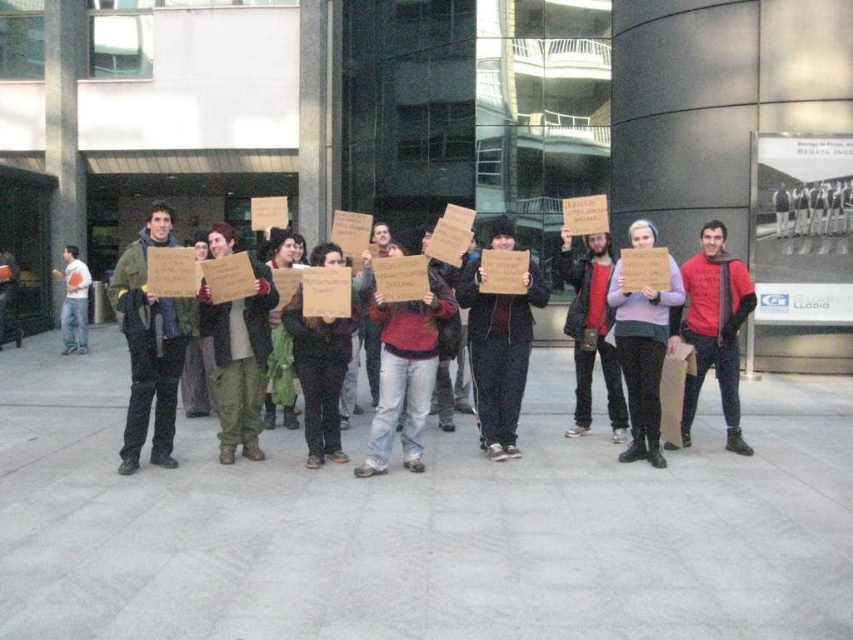
Describe the element at coordinates (498, 353) in the screenshot. I see `dark gray pants at center` at that location.

Locate an element on the screen. This screenshot has height=640, width=853. dark gray pants at center is located at coordinates (498, 353).

Can you confirm if matte cardboard sign at center is positioned to the left of matte red sweater at center?

Correct, you'll find matte cardboard sign at center to the left of matte red sweater at center.

Between point (172, 388) and point (399, 403), which one is positioned behind?

Point (172, 388)

Does point (268, 275) lie behind point (399, 422)?

No, (268, 275) is closer to viewer.

At what (x,y) coordinates should I click in order to perform the action: click on matte cardboard sign at center. Please return your answer as a coordinate pair (x, y). Looking at the image, I should click on (155, 348).

What do you see at coordinates (149, 342) in the screenshot? This screenshot has height=640, width=853. I see `green fabric jacket at left` at bounding box center [149, 342].

Which is behind, point (142, 436) or point (508, 374)?

Positioned behind is point (508, 374).

The width and height of the screenshot is (853, 640). In order to click on green fabric jacket at left in this screenshot , I will do `click(149, 342)`.